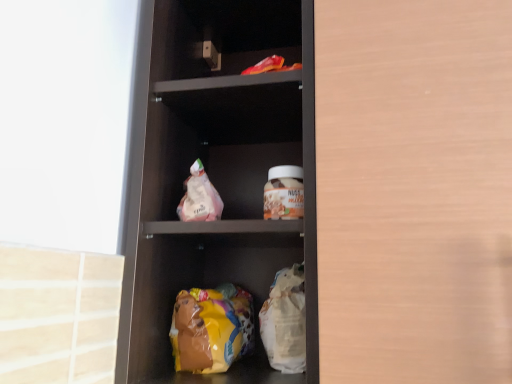
What do you see at coordinates (217, 173) in the screenshot? I see `matte plastic shelf at center` at bounding box center [217, 173].

The width and height of the screenshot is (512, 384). What do you see at coordinates (199, 197) in the screenshot? I see `translucent plastic bag at center` at bounding box center [199, 197].

Where is `wooden cabinet door at right`? The image size is (512, 384). wooden cabinet door at right is located at coordinates (414, 190).

Where is `matte plastic shelf at center`? matte plastic shelf at center is located at coordinates (217, 173).

Between translucent plastic bag at center and matte plastic shelf at center, which one has smaller width?

translucent plastic bag at center is thinner.

Between translucent plastic bag at center and matte plastic shelf at center, which one has more height?

matte plastic shelf at center.

Consider the image. Which object is closer to the camera, translucent plastic bag at center or matte plastic shelf at center?

matte plastic shelf at center.

Is matte plastic shelf at center oriented away from translucent plastic bag at center?

Yes, matte plastic shelf at center is facing away from translucent plastic bag at center.

Does matte plastic shelf at center have a greater height compared to translucent plastic bag at center?

Yes, matte plastic shelf at center is taller than translucent plastic bag at center.

Does matte plastic shelf at center have a lesser width compared to translucent plastic bag at center?

In fact, matte plastic shelf at center might be wider than translucent plastic bag at center.

From the picture: Considering the relative sizes of matte plastic shelf at center and yellow plastic bag at lower center in the image provided, is matte plastic shelf at center bigger than yellow plastic bag at lower center?

Indeed, matte plastic shelf at center has a larger size compared to yellow plastic bag at lower center.

Which of these two, matte plastic shelf at center or yellow plastic bag at lower center, stands taller?

Standing taller between the two is matte plastic shelf at center.

Would you say matte plastic shelf at center is a long distance from yellow plastic bag at lower center?

They are positioned close to each other.

Consider the image. Which object is positioned more to the left, matte plastic shelf at center or yellow plastic bag at lower center?

yellow plastic bag at lower center.

From the image's perspective, which is below, wooden cabinet door at right or yellow plastic bag at lower center?

yellow plastic bag at lower center appears lower in the image.

In order to click on glass door located above the yellow plastic bag at lower center (from a real-world perspective) in this screenshot , I will do `click(414, 190)`.

Is wooden cabinet door at right touching yellow plastic bag at lower center?

No, wooden cabinet door at right is not in contact with yellow plastic bag at lower center.

In order to click on shelf located above the wooden cabinet door at right (from a real-world perspective) in this screenshot , I will do `click(217, 173)`.

Is matte plastic shelf at center inside the boundaries of wooden cabinet door at right, or outside?

matte plastic shelf at center cannot be found inside wooden cabinet door at right.

Which object is thinner, matte plastic shelf at center or wooden cabinet door at right?

Thinner between the two is matte plastic shelf at center.

Is matte plastic shelf at center facing away from wooden cabinet door at right?

No, wooden cabinet door at right is not at the back of matte plastic shelf at center.

From the picture: Is translucent plastic bag at center touching matte brown glass jar at center?

translucent plastic bag at center and matte brown glass jar at center are clearly separated.

Between translucent plastic bag at center and matte brown glass jar at center, which one has larger size?

translucent plastic bag at center.

Can you confirm if translucent plastic bag at center is positioned to the left of matte brown glass jar at center?

Yes.

Between translucent plastic bag at center and matte brown glass jar at center, which one has smaller width?

matte brown glass jar at center.

Could you tell me if matte plastic shelf at center is turned towards matte brown glass jar at center?

Yes.

Based on the photo, between matte plastic shelf at center and matte brown glass jar at center, which one has smaller size?

With smaller size is matte brown glass jar at center.

Does point (248, 371) come behind point (301, 193)?

That is True.

From a real-world perspective, is matte plastic shelf at center over matte brown glass jar at center?

Yes.

Identify the location of snack below the matte plastic shelf at center (from a real-world perspective). (199, 197).

You are a GUI agent. You are given a task and a screenshot of the screen. Output one action in this format:
    pyautogui.click(x=<x>, y=<y>)
    Task: Click on the shelf above the translucent plastic bag at center (from the image's perspective)
    The image size is (512, 384).
    Given the screenshot: What is the action you would take?
    pyautogui.click(x=217, y=173)

Considering their positions, is translucent plastic bag at center positioned closer to yellow plastic bag at lower center than matte plastic shelf at center?

translucent plastic bag at center is closer to yellow plastic bag at lower center.

Looking at the image, which one is located closer to wooden cabinet door at right, translucent plastic bag at center or matte plastic shelf at center?

Based on the image, matte plastic shelf at center appears to be nearer to wooden cabinet door at right.

Which object lies further to the anchor point matte plastic shelf at center, translucent plastic bag at center or matte brown glass jar at center?

matte brown glass jar at center lies further to matte plastic shelf at center than the other object.

From the image, which object appears to be farther from translucent plastic bag at center, matte brown glass jar at center or wooden cabinet door at right?

Based on the image, wooden cabinet door at right appears to be further to translucent plastic bag at center.

Which object lies nearer to the anchor point translucent plastic bag at center, yellow plastic bag at lower center or matte brown glass jar at center?

matte brown glass jar at center lies closer to translucent plastic bag at center than the other object.

When comparing their distances from matte plastic shelf at center, does translucent plastic bag at center or yellow plastic bag at lower center seem closer?

Result: Based on the image, translucent plastic bag at center appears to be nearer to matte plastic shelf at center.

From the image, which object appears to be nearer to yellow plastic bag at lower center, translucent plastic bag at center or matte brown glass jar at center?

Among the two, translucent plastic bag at center is located nearer to yellow plastic bag at lower center.

Considering their positions, is matte brown glass jar at center positioned closer to matte plastic shelf at center than wooden cabinet door at right?

wooden cabinet door at right.

The width and height of the screenshot is (512, 384). In order to click on shelf situated between yellow plastic bag at lower center and wooden cabinet door at right from left to right in this screenshot , I will do `click(217, 173)`.

In order to click on glass jar between matte plastic shelf at center and wooden cabinet door at right in the horizontal direction in this screenshot , I will do `click(284, 193)`.

Where is `snack located between matte plastic shelf at center and matte brown glass jar at center in the depth direction`? The height and width of the screenshot is (384, 512). snack located between matte plastic shelf at center and matte brown glass jar at center in the depth direction is located at coordinates (199, 197).

Where is `glass jar that lies between translucent plastic bag at center and yellow plastic bag at lower center from top to bottom`? Image resolution: width=512 pixels, height=384 pixels. glass jar that lies between translucent plastic bag at center and yellow plastic bag at lower center from top to bottom is located at coordinates (284, 193).